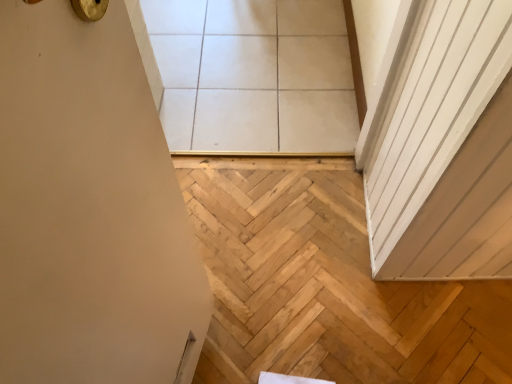
Question: Is white glossy tile at upper center bigger than natural wood stairwell at lower right?

Choices:
 (A) no
 (B) yes

Answer: (B)

Question: Is white glossy tile at upper center surrounding natural wood stairwell at lower right?

Choices:
 (A) yes
 (B) no

Answer: (B)

Question: Can you confirm if white glossy tile at upper center is taller than natural wood stairwell at lower right?

Choices:
 (A) no
 (B) yes

Answer: (A)

Question: From a real-world perspective, is white glossy tile at upper center positioned over natural wood stairwell at lower right based on gravity?

Choices:
 (A) yes
 (B) no

Answer: (A)

Question: From the image's perspective, is white glossy tile at upper center beneath natural wood stairwell at lower right?

Choices:
 (A) no
 (B) yes

Answer: (A)

Question: Can you confirm if white glossy tile at upper center is shorter than natural wood stairwell at lower right?

Choices:
 (A) no
 (B) yes

Answer: (B)

Question: From a real-world perspective, is natural wood stairwell at lower right positioned under white glossy tile at upper center based on gravity?

Choices:
 (A) yes
 (B) no

Answer: (A)

Question: Considering the relative sizes of natural wood stairwell at lower right and white glossy tile at upper center in the image provided, is natural wood stairwell at lower right bigger than white glossy tile at upper center?

Choices:
 (A) yes
 (B) no

Answer: (B)

Question: Does natural wood stairwell at lower right have a smaller size compared to white glossy tile at upper center?

Choices:
 (A) no
 (B) yes

Answer: (B)

Question: Would you say natural wood stairwell at lower right is a long distance from white glossy tile at upper center?

Choices:
 (A) no
 (B) yes

Answer: (A)

Question: Could you tell me if natural wood stairwell at lower right is turned towards white glossy tile at upper center?

Choices:
 (A) no
 (B) yes

Answer: (B)

Question: Is natural wood stairwell at lower right to the left of white glossy tile at upper center from the viewer's perspective?

Choices:
 (A) yes
 (B) no

Answer: (B)

Question: In terms of width, does natural wood stairwell at lower right look wider or thinner when compared to white glossy tile at upper center?

Choices:
 (A) thin
 (B) wide

Answer: (A)